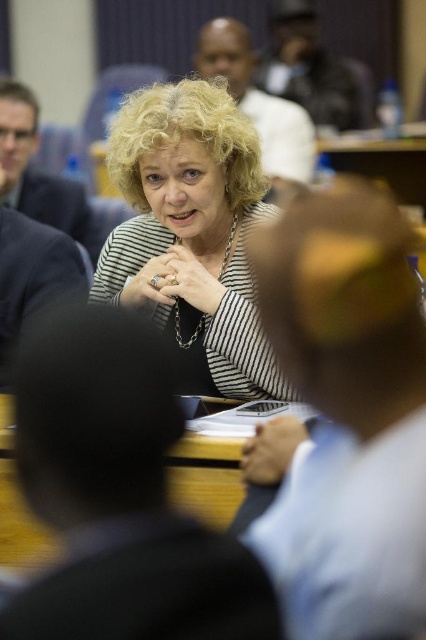
Question: Is striped fabric woman at center below wooden table at center?

Choices:
 (A) yes
 (B) no

Answer: (B)

Question: Among these objects, which one is farthest from the camera?

Choices:
 (A) wooden table at center
 (B) striped fabric woman at center

Answer: (B)

Question: Which point is farther to the camera?

Choices:
 (A) (124, 131)
 (B) (9, 554)

Answer: (A)

Question: Observing the image, what is the correct spatial positioning of striped fabric woman at center in reference to wooden table at center?

Choices:
 (A) below
 (B) above

Answer: (B)

Question: Can you confirm if striped fabric woman at center is smaller than wooden table at center?

Choices:
 (A) no
 (B) yes

Answer: (A)

Question: Which of the following is the closest to the observer?

Choices:
 (A) (230, 349)
 (B) (43, 548)

Answer: (B)